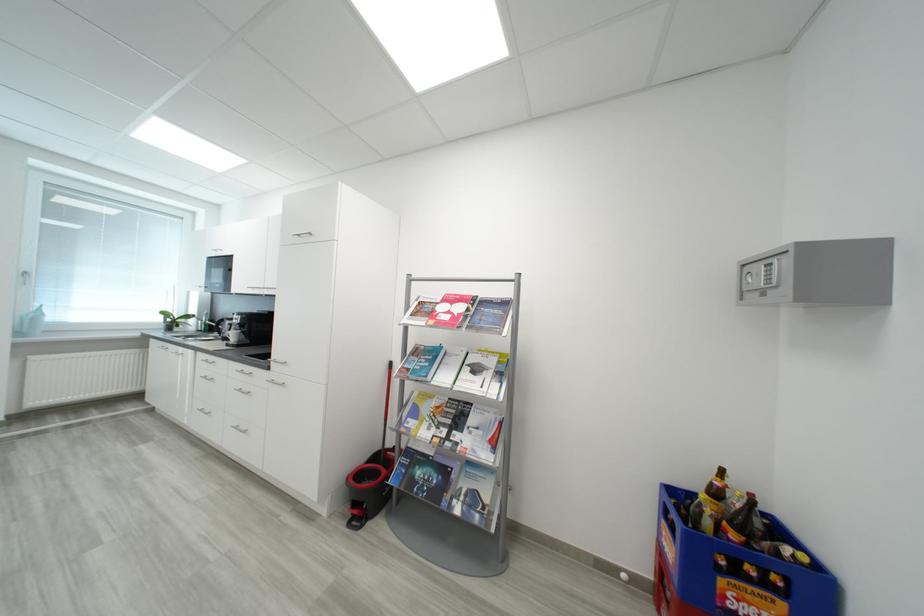
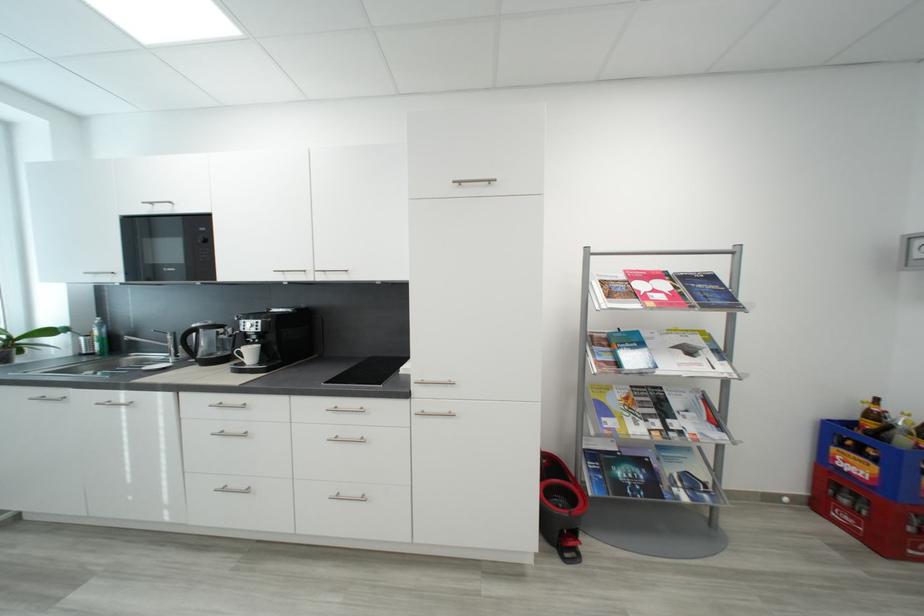
In the second image, find the point that corresponds to point 723,493 in the first image.

(881, 418)